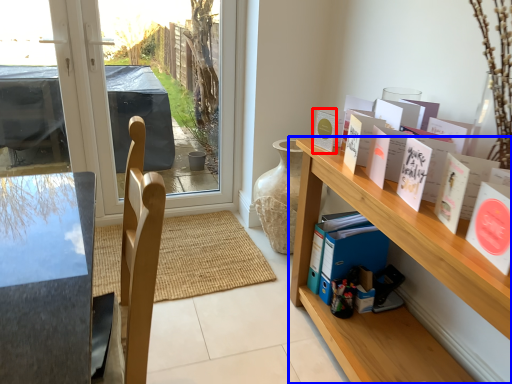
Question: Among these objects, which one is nearest to the camera, book (highlighted by a red box) or shelf (highlighted by a blue box)?

Choices:
 (A) book
 (B) shelf

Answer: (B)